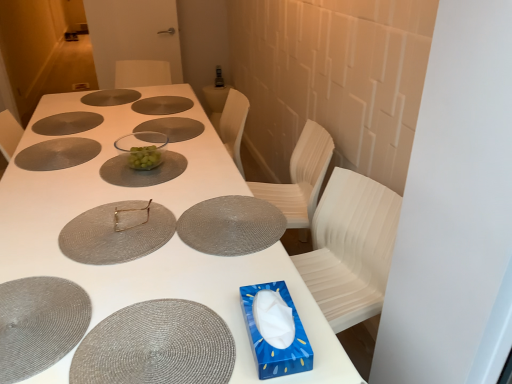
Identify the location of free space above woven gray placemat at lower left (from a real-world perspective). (35, 308).